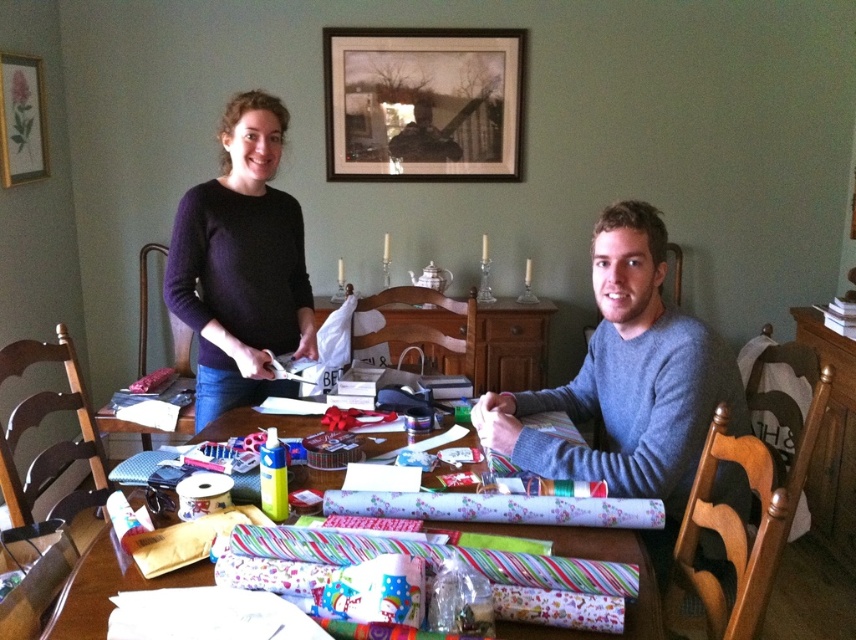
Does gray sweater at center appear on the right side of gold-framed picture at upper left?

Indeed, gray sweater at center is positioned on the right side of gold-framed picture at upper left.

Who is more forward, (724, 372) or (28, 99)?

Point (724, 372) is in front.

Between point (616, 326) and point (27, 77), which one is positioned behind?

The point (27, 77) is more distant.

Locate an element on the screen. Image resolution: width=856 pixels, height=640 pixels. gray sweater at center is located at coordinates (627, 378).

What do you see at coordinates (241, 264) in the screenshot?
I see `dark purple sweater at upper left` at bounding box center [241, 264].

Between dark purple sweater at upper left and gold-framed picture at upper left, which one appears on the left side from the viewer's perspective?

From the viewer's perspective, gold-framed picture at upper left appears more on the left side.

Where is `dark purple sweater at upper left`? The height and width of the screenshot is (640, 856). dark purple sweater at upper left is located at coordinates 241,264.

Does gray sweater at center appear on the left side of dark purple sweater at upper left?

In fact, gray sweater at center is to the right of dark purple sweater at upper left.

Image resolution: width=856 pixels, height=640 pixels. What do you see at coordinates (627, 378) in the screenshot?
I see `gray sweater at center` at bounding box center [627, 378].

Find the location of a particular element. This screenshot has height=640, width=856. gray sweater at center is located at coordinates (627, 378).